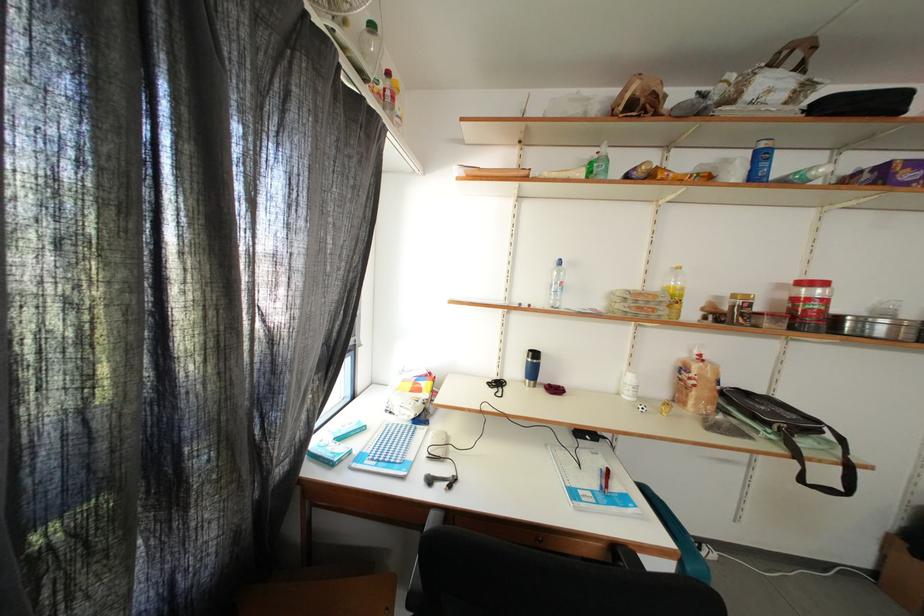
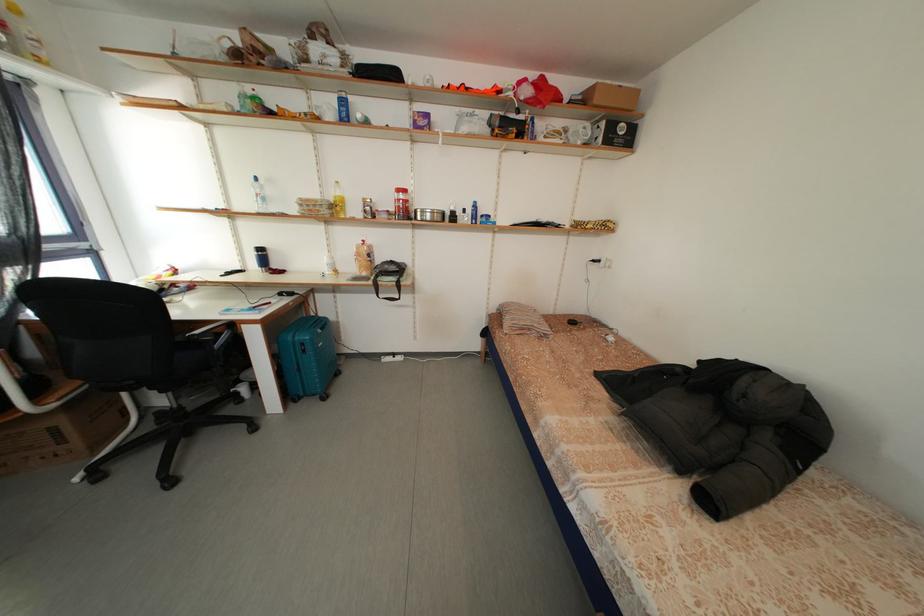
Which direction would the cameraman need to move to produce the second image?

The movement direction of the cameraman is right, backward.